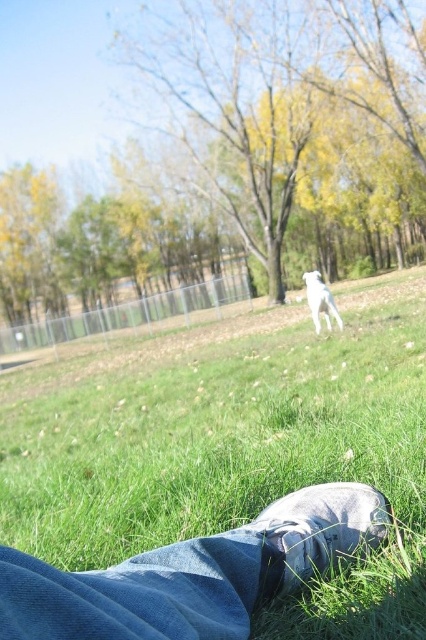
You are lying on the grass in the scene and want to reach two points marked in the image. Which point, point (187, 417) or point (359, 529), is closer to you?

Point (187, 417) is closer to you because it is further to the viewer than point (359, 529).

You are lying on the grass and see the denim at lower center and the white fur dog at center. Which object is closer to your face?

The denim at lower center is closer to your face because it is in front of the white fur dog at center.

You are lying on the grass and looking at two points in the scene. The first point is at coordinates point (325,524) and the second point is at point (345,500). Which point appears closer to you?

Point (325,524) is closer to the camera than point (345,500), so the first point appears closer to you.